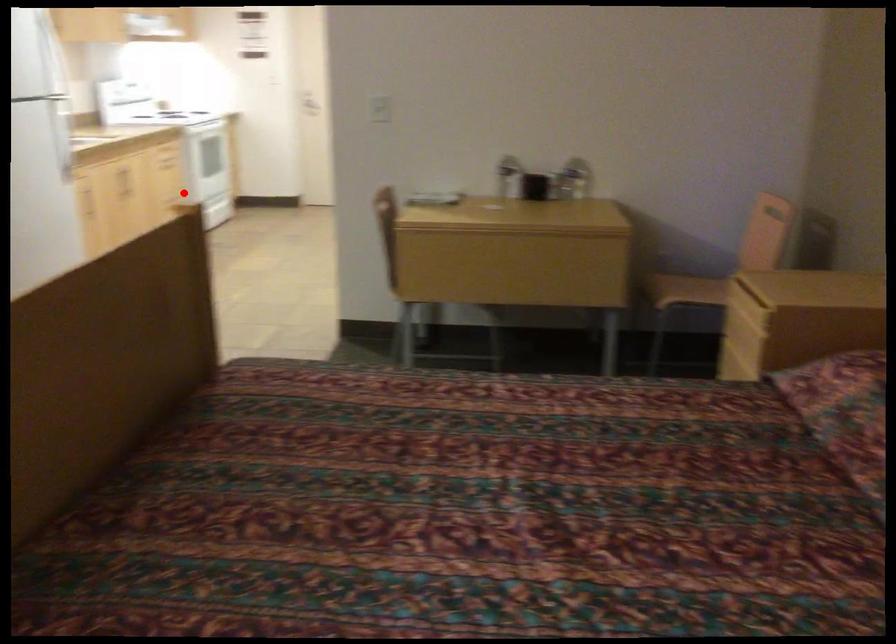
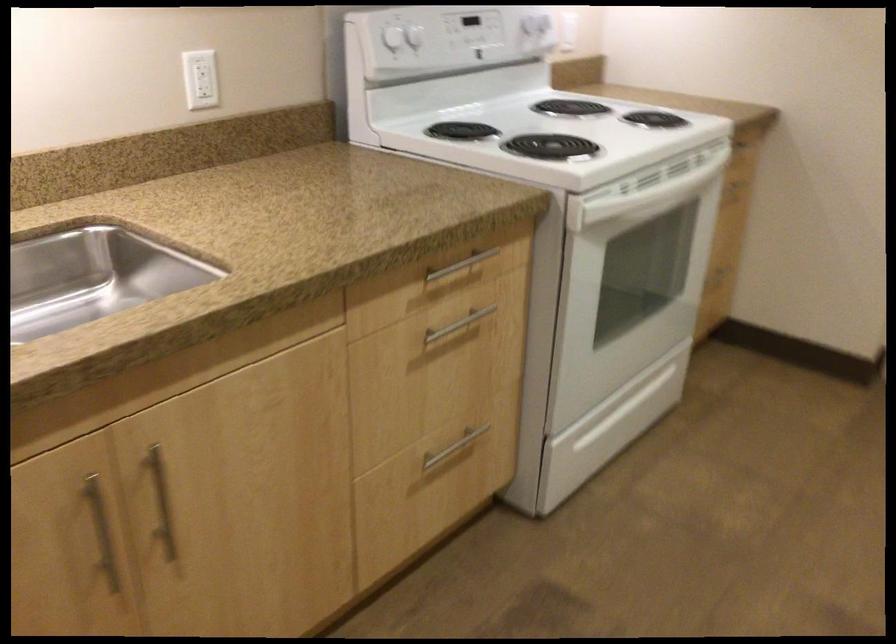
Question: I am providing you with two images of the same scene from different viewpoints. A red point is shown in image1. For the corresponding object point in image2, is it positioned nearer or farther from the camera?

Choices:
 (A) Nearer
 (B) Farther

Answer: (A)